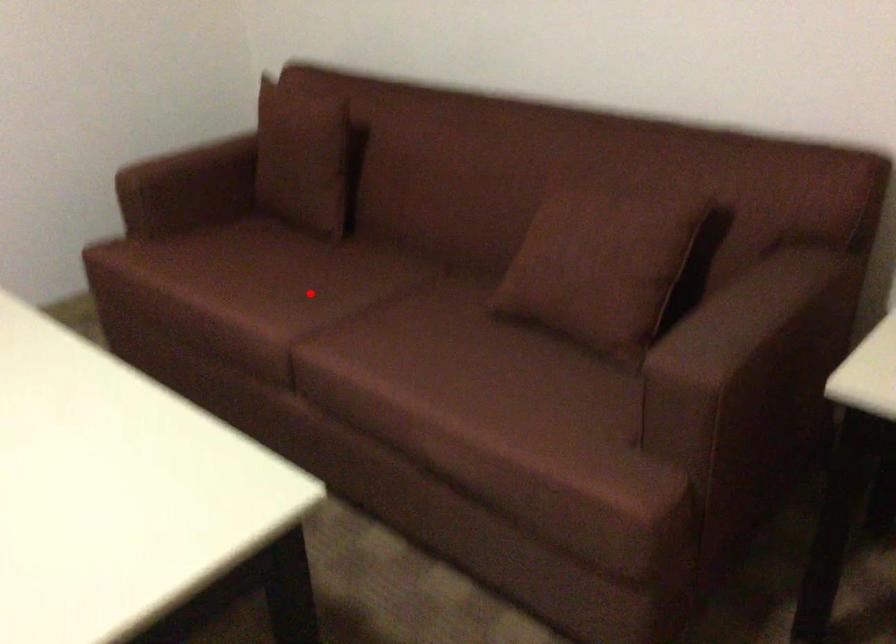
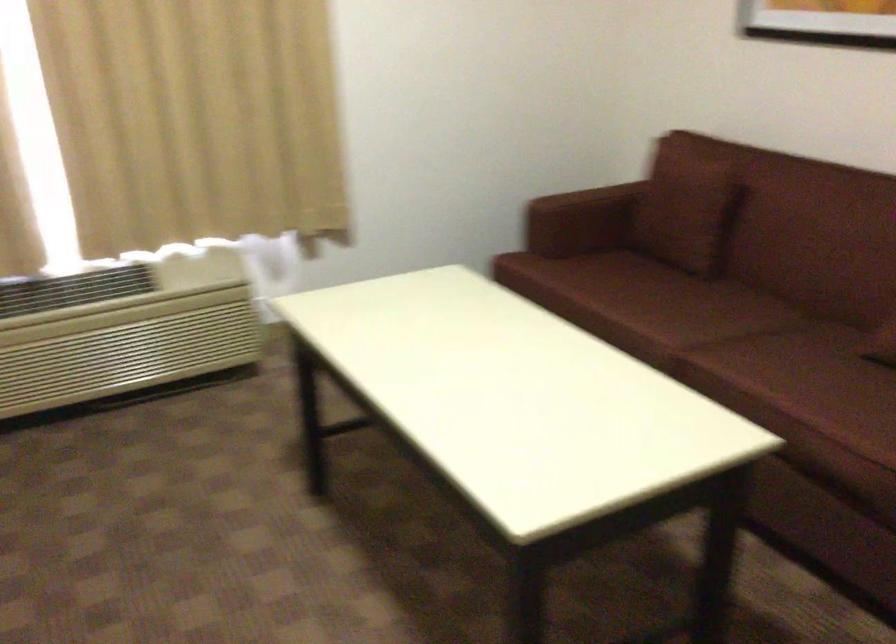
The point at the highlighted location is marked in the first image. Where is the corresponding point in the second image?

(682, 310)